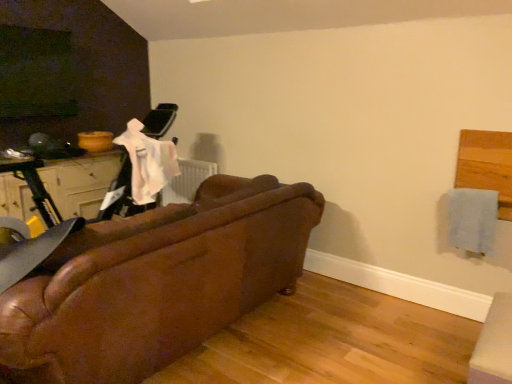
Where is `matte white drawer at left`? The image size is (512, 384). matte white drawer at left is located at coordinates (80, 183).

Does matte white drawer at left lie behind light blue fabric at upper right?

Yes, the depth of matte white drawer at left is greater than that of light blue fabric at upper right.

Is matte white drawer at left looking in the opposite direction of light blue fabric at upper right?

No, matte white drawer at left is not facing the opposite direction of light blue fabric at upper right.

Considering the relative sizes of matte white drawer at left and light blue fabric at upper right in the image provided, is matte white drawer at left wider than light blue fabric at upper right?

Yes.

From the image's perspective, is matte white drawer at left on top of light blue fabric at upper right?

Yes, from the image's perspective, matte white drawer at left is on top of light blue fabric at upper right.

Is light blue fabric at upper right taller than matte white drawer at left?

No, light blue fabric at upper right is not taller than matte white drawer at left.

Could you tell me if light blue fabric at upper right is turned towards matte white drawer at left?

No, light blue fabric at upper right is not facing towards matte white drawer at left.

Could matte white drawer at left be considered to be inside light blue fabric at upper right?

Definitely not — matte white drawer at left is not inside light blue fabric at upper right.

From the image's perspective, which is above, light blue fabric at upper right or matte white drawer at left?

matte white drawer at left is shown above in the image.

Is leather couch at center facing away from light blue fabric at upper right?

A: Yes.

Considering the sizes of objects leather couch at center and light blue fabric at upper right in the image provided, who is bigger, leather couch at center or light blue fabric at upper right?

With larger size is leather couch at center.

Does leather couch at center have a lesser height compared to light blue fabric at upper right?

No.

Between point (54, 348) and point (457, 203), which one is positioned in front?

Point (54, 348)

Does leather couch at center touch matte white drawer at left?

No, leather couch at center is not touching matte white drawer at left.

In the image, is leather couch at center on the left side or the right side of matte white drawer at left?

From the image, it's evident that leather couch at center is to the right of matte white drawer at left.

Is leather couch at center positioned before matte white drawer at left?

Yes, leather couch at center is closer to the camera.

From a real-world perspective, who is located lower, leather couch at center or matte white drawer at left?

leather couch at center is physically lower.

Is leather couch at center at the back of light blue fabric at upper right?

light blue fabric at upper right is not turned away from leather couch at center.

Does light blue fabric at upper right have a lesser height compared to leather couch at center?

Indeed, light blue fabric at upper right has a lesser height compared to leather couch at center.

Is point (489, 250) farther from camera compared to point (167, 348)?

Yes, it is.

Can you confirm if matte white drawer at left is positioned to the right of leather couch at center?

In fact, matte white drawer at left is to the left of leather couch at center.

Is matte white drawer at left positioned with its back to leather couch at center?

No.

Locate an element on the screen. drawer to the left of leather couch at center is located at coordinates (80, 183).

Is matte white drawer at left next to leather couch at center?

They are not placed beside each other.

Locate an element on the screen. Image resolution: width=512 pixels, height=384 pixels. clothe that is below the matte white drawer at left (from the image's perspective) is located at coordinates (472, 219).

Find the location of a particular element. The width and height of the screenshot is (512, 384). clothe on the right of matte white drawer at left is located at coordinates (472, 219).

Which object lies further to the anchor point leather couch at center, light blue fabric at upper right or matte white drawer at left?

matte white drawer at left is positioned further to the anchor leather couch at center.

When comparing their distances from light blue fabric at upper right, does matte white drawer at left or leather couch at center seem further?

Among the two, matte white drawer at left is located further to light blue fabric at upper right.

Looking at this image, considering their positions, is matte white drawer at left positioned further to leather couch at center than light blue fabric at upper right?

matte white drawer at left is further to leather couch at center.

Which object lies further to the anchor point light blue fabric at upper right, leather couch at center or matte white drawer at left?

Based on the image, matte white drawer at left appears to be further to light blue fabric at upper right.

Based on their spatial positions, is light blue fabric at upper right or leather couch at center closer to matte white drawer at left?

leather couch at center is closer to matte white drawer at left.

Looking at the image, which one is located further to matte white drawer at left, leather couch at center or light blue fabric at upper right?

The object further to matte white drawer at left is light blue fabric at upper right.

Locate an element on the screen. This screenshot has width=512, height=384. studio couch between matte white drawer at left and light blue fabric at upper right in the horizontal direction is located at coordinates (155, 283).